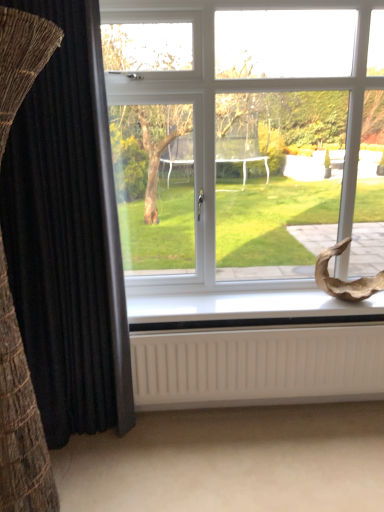
Question: Is white plastic window sill at lower center positioned far away from white matte radiator at bottom?

Choices:
 (A) yes
 (B) no

Answer: (B)

Question: Does white plastic window sill at lower center have a lesser height compared to white matte radiator at bottom?

Choices:
 (A) yes
 (B) no

Answer: (A)

Question: Is white plastic window sill at lower center further to the viewer compared to white matte radiator at bottom?

Choices:
 (A) yes
 (B) no

Answer: (A)

Question: From a real-world perspective, does white plastic window sill at lower center sit lower than white matte radiator at bottom?

Choices:
 (A) no
 (B) yes

Answer: (A)

Question: Considering the relative sizes of white plastic window sill at lower center and white matte radiator at bottom in the image provided, is white plastic window sill at lower center thinner than white matte radiator at bottom?

Choices:
 (A) no
 (B) yes

Answer: (A)

Question: From the image's perspective, is black velvet curtain at left positioned above or below white matte radiator at bottom?

Choices:
 (A) below
 (B) above

Answer: (B)

Question: Is black velvet curtain at left spatially inside white matte radiator at bottom, or outside of it?

Choices:
 (A) outside
 (B) inside

Answer: (A)

Question: From a real-world perspective, is black velvet curtain at left positioned above or below white matte radiator at bottom?

Choices:
 (A) below
 (B) above

Answer: (B)

Question: Considering the positions of black velvet curtain at left and white matte radiator at bottom in the image, is black velvet curtain at left taller or shorter than white matte radiator at bottom?

Choices:
 (A) short
 (B) tall

Answer: (B)

Question: From their relative heights in the image, would you say white matte radiator at bottom is taller or shorter than white plastic window sill at lower center?

Choices:
 (A) short
 (B) tall

Answer: (B)

Question: Does point (175, 376) appear closer or farther from the camera than point (185, 327)?

Choices:
 (A) farther
 (B) closer

Answer: (A)

Question: Would you say white matte radiator at bottom is inside or outside white plastic window sill at lower center?

Choices:
 (A) outside
 (B) inside

Answer: (A)

Question: From the image's perspective, is white matte radiator at bottom located above or below white plastic window sill at lower center?

Choices:
 (A) below
 (B) above

Answer: (A)

Question: Is point (296, 18) closer or farther from the camera than point (11, 287)?

Choices:
 (A) closer
 (B) farther

Answer: (B)

Question: Relative to black velvet curtain at left, is white plastic window at center in front or behind?

Choices:
 (A) front
 (B) behind

Answer: (B)